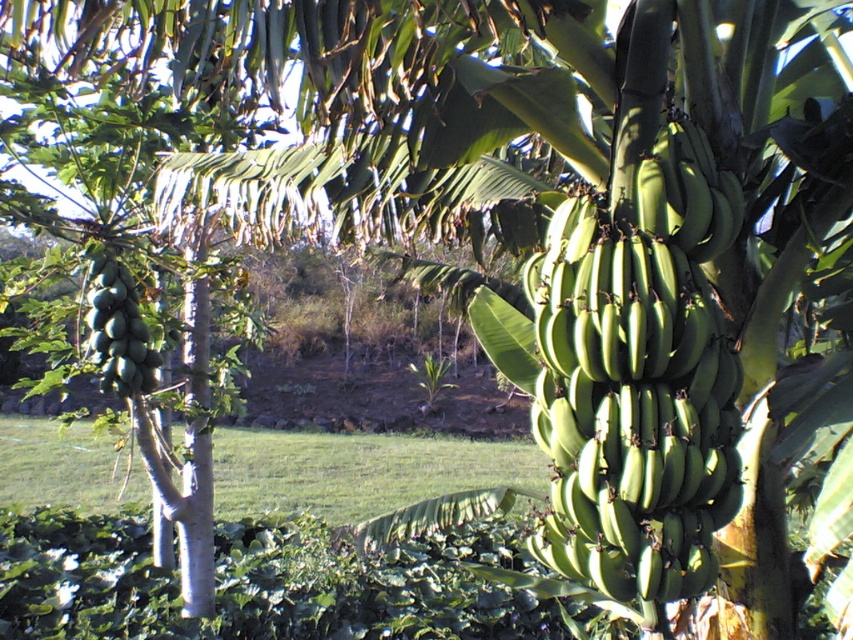
You are a farmer checking the growth of your crops. You notice the green matte bananas at center and the green matte papaya at left. Which one has a bigger fruit size?

The green matte bananas at center is larger in size than the green matte papaya at left.

You are a farmer inspecting your tropical garden. You have to determine which of the two plants, the green matte bananas at center or the green matte papaya at left, has taller fruit clusters. Which one do you conclude?

The green matte bananas at center has a greater height compared to the green matte papaya at left, so the bananas are taller.

You are standing in a tropical garden and want to take a photo of the banana tree with large, green bananas clustered together in bunches hanging from its branches and the papaya tree with clusters of unripe papayas hanging from its branches. If you position yourself at point point (607, 312), will the banana tree with large, green bananas clustered together in bunches hanging from its branches be closer to you than the papaya tree with clusters of unripe papayas hanging from its branches?

The point (607, 312) is 7.52 feet from the camera. However, the exact distances of the banana tree with large, green bananas clustered together in bunches hanging from its branches and the papaya tree with clusters of unripe papayas hanging from its branches from the camera are not provided. Therefore, it is impossible to determine if the banana tree is closer to you than the papaya tree based on the given information.